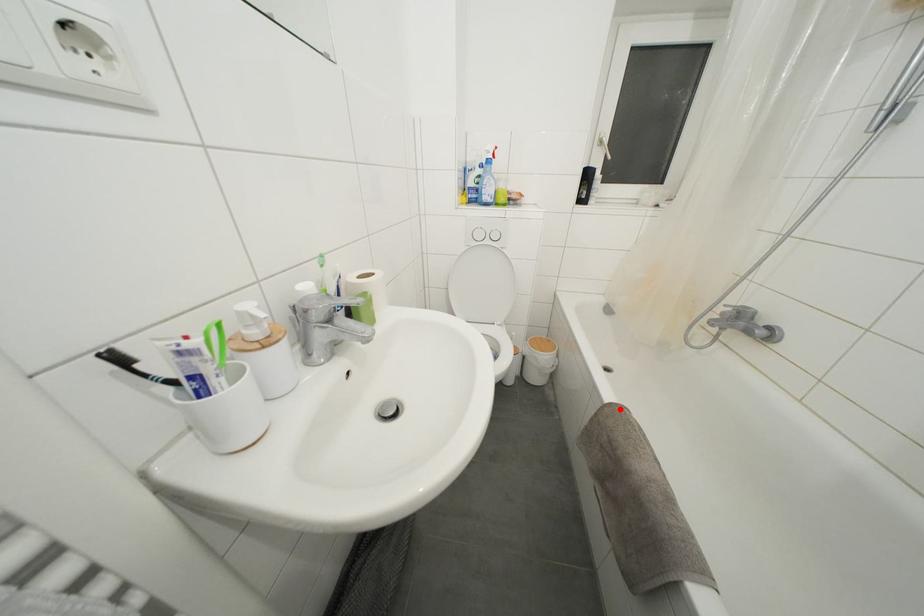
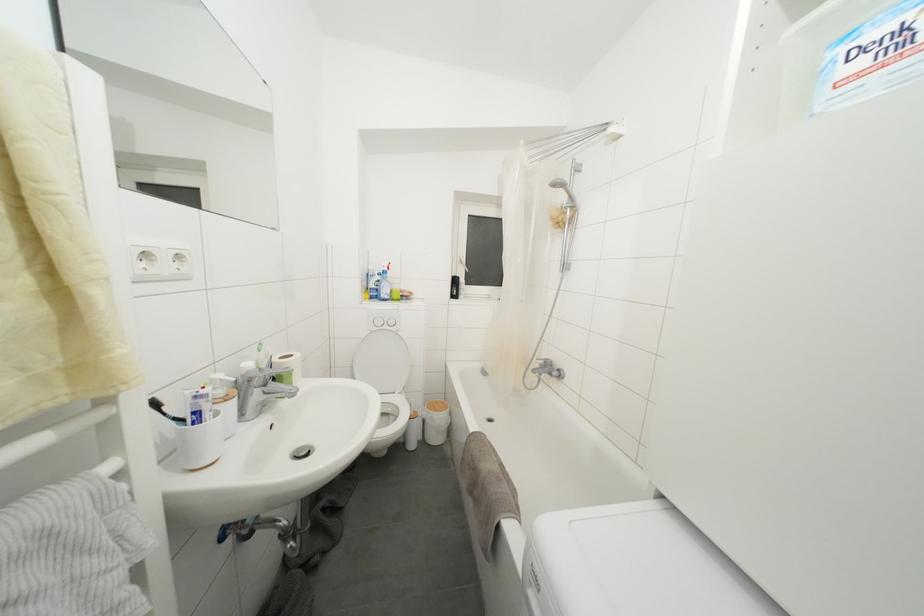
Locate, in the second image, the point that corresponds to the highlighted location in the first image.

(480, 438)